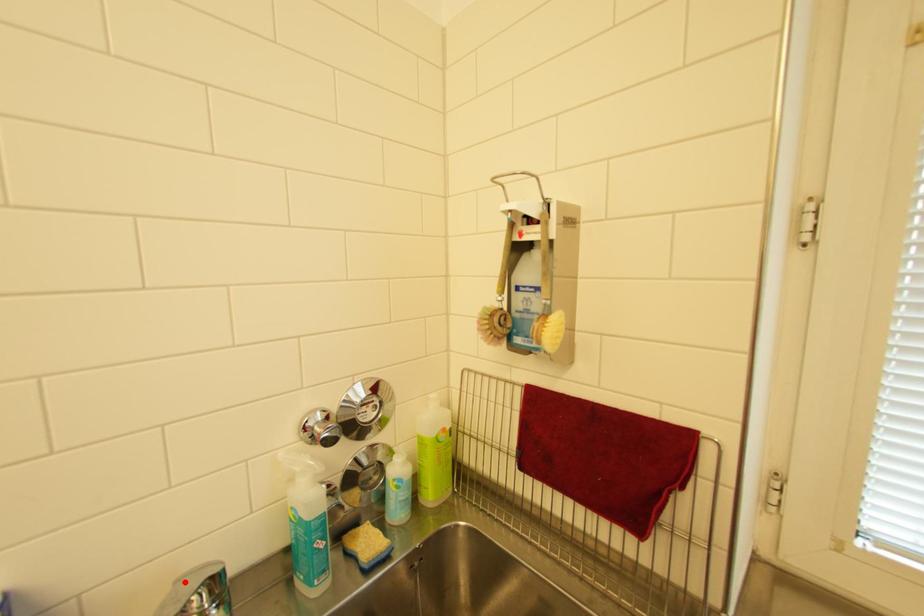
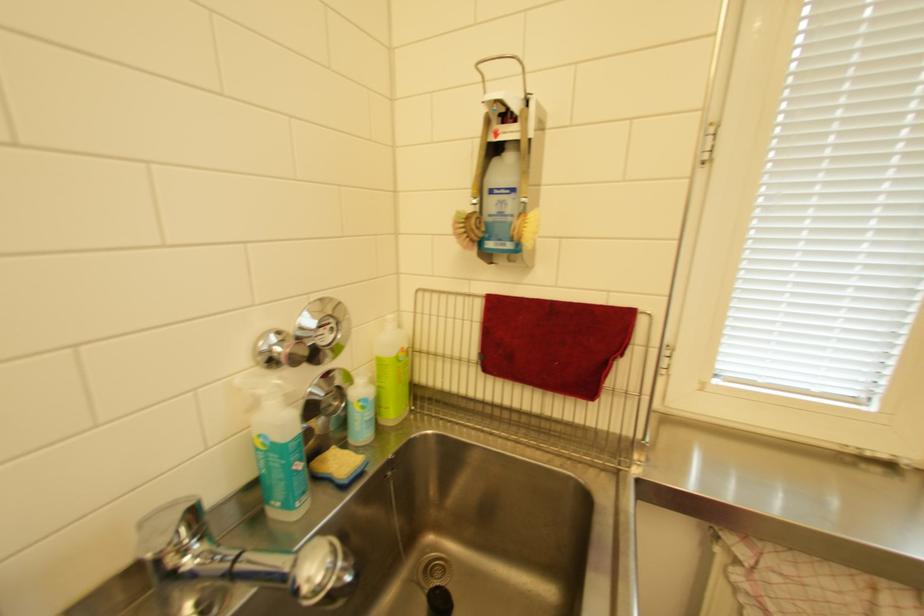
Find the pixel in the second image that matches the highlighted location in the first image.

(150, 524)